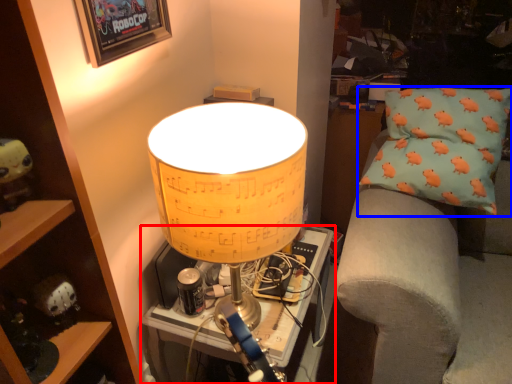
Question: Among these objects, which one is nearest to the camera, table (highlighted by a red box) or pillow (highlighted by a blue box)?

Choices:
 (A) table
 (B) pillow

Answer: (A)